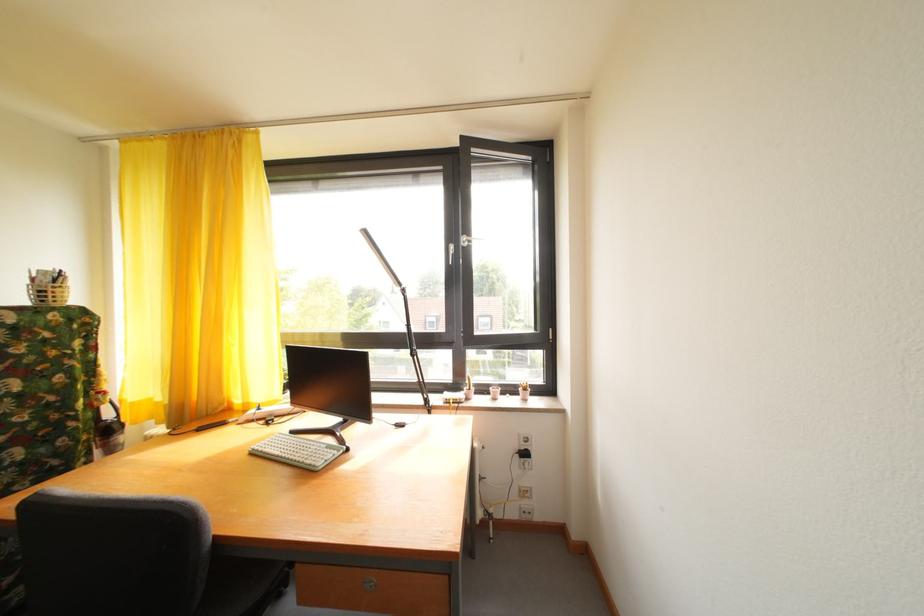
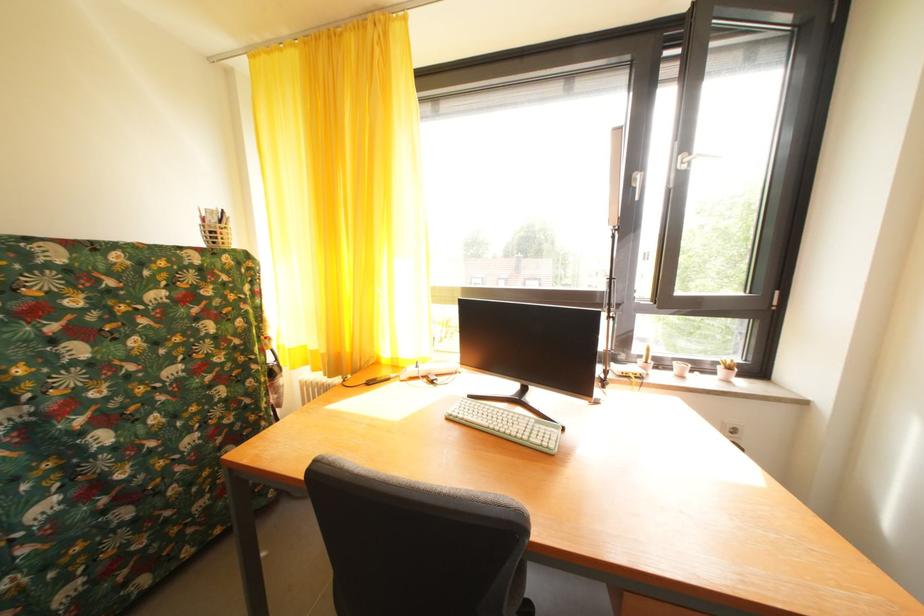
Question: Based on the continuous images, in which direction is the camera rotating? Reply with the corresponding letter.

Choices:
 (A) Left
 (B) Right
 (C) Up
 (D) Down

Answer: (A)